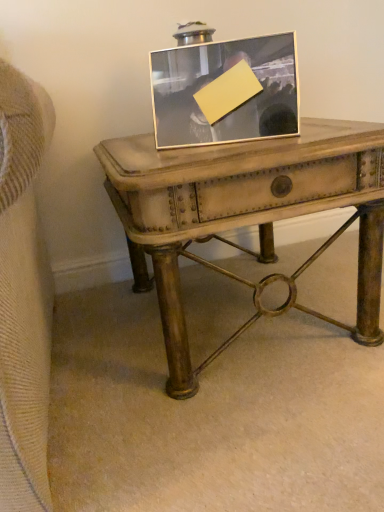
The image size is (384, 512). In order to click on free space on the front side of silver/metallic picture frame at center in this screenshot , I will do `click(225, 153)`.